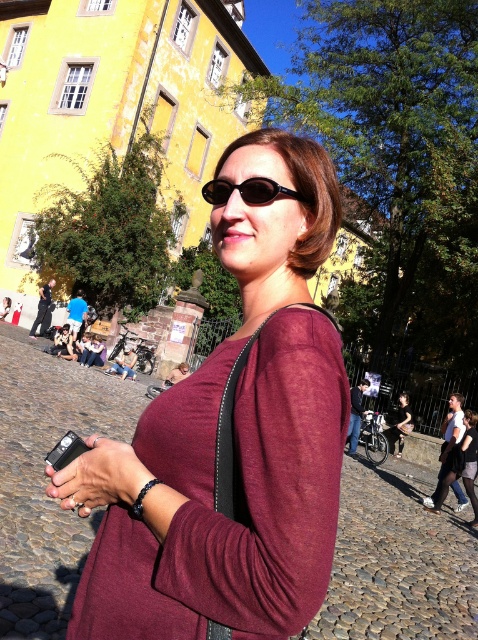
Question: Which point is farther to the camera?

Choices:
 (A) burgundy fabric shirt at center
 (B) black plastic sunglasses at center
 (C) matte black dress at center
 (D) matte black camera at center

Answer: (C)

Question: Does matte black jacket at center appear on the right side of matte black camera at center?

Choices:
 (A) no
 (B) yes

Answer: (B)

Question: Based on their relative distances, which object is nearer to the black leather pants at lower right?

Choices:
 (A) matte black camera at center
 (B) matte black dress at center
 (C) matte black jacket at center

Answer: (A)

Question: Which is nearer to the matte black dress at center?

Choices:
 (A) black plastic sunglasses at center
 (B) matte black camera at center
 (C) matte black phone at center
 (D) black leather pants at lower right

Answer: (B)

Question: Can you confirm if matte black phone at center is thinner than matte black dress at center?

Choices:
 (A) no
 (B) yes

Answer: (B)

Question: Can you confirm if matte black phone at center is bigger than matte black camera at center?

Choices:
 (A) yes
 (B) no

Answer: (B)